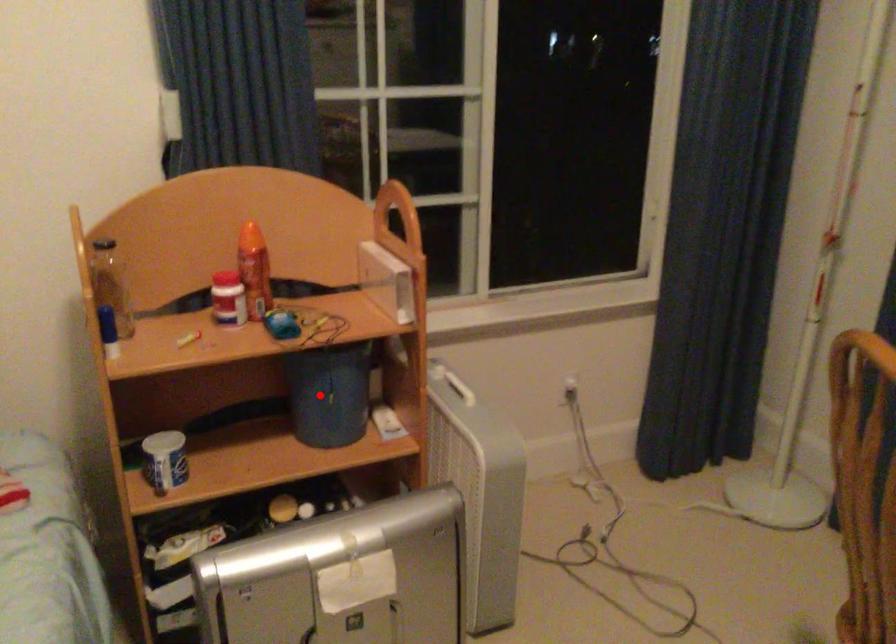
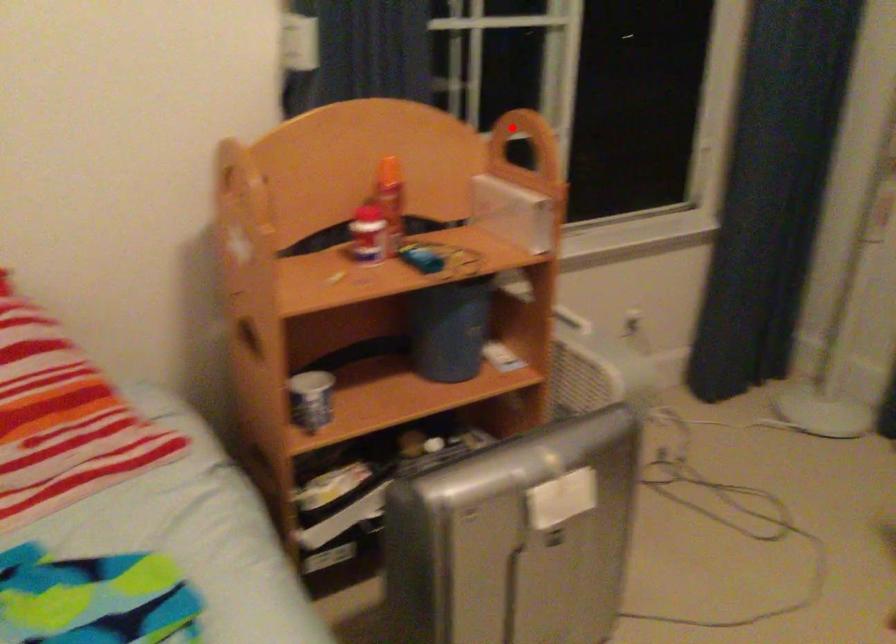
I am providing you with two images of the same scene from different viewpoints. A red point is marked on the first image and another point is marked on the second image. Do the highlighted points in image1 and image2 indicate the same real-world spot?

No